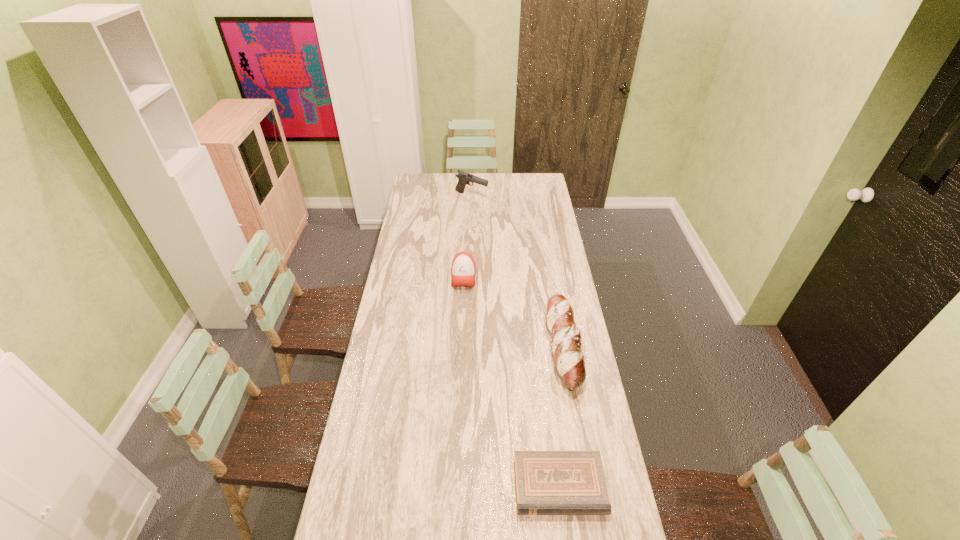
At what (x,y) coordinates should I click in order to perform the action: click on baguet that is at the right edge. Please return your answer as a coordinate pair (x, y). This screenshot has width=960, height=540. Looking at the image, I should click on (569, 361).

This screenshot has width=960, height=540. Identify the location of Bible that is at the right edge. (547, 482).

Find the location of a particular element. Image resolution: width=960 pixels, height=540 pixels. vacant area at the far edge is located at coordinates (521, 181).

This screenshot has height=540, width=960. I want to click on vacant point at the left edge, so click(343, 504).

Where is `vacant space at the right edge of the desktop`? Image resolution: width=960 pixels, height=540 pixels. vacant space at the right edge of the desktop is located at coordinates (551, 223).

At what (x,y) coordinates should I click in order to perform the action: click on unoccupied position between the second farthest object and the third farthest object. Please return your answer as a coordinate pair (x, y). Looking at the image, I should click on (514, 311).

Find the location of a particular element. free point between the third farthest object and the nearest object is located at coordinates (562, 416).

Where is `free space between the second nearest object and the nearest object`? free space between the second nearest object and the nearest object is located at coordinates (562, 416).

I want to click on empty space that is in between the shortest object and the farthest object, so (516, 341).

Locate an element on the screen. The image size is (960, 540). vacant area that lies between the baseball cap and the third farthest object is located at coordinates (514, 311).